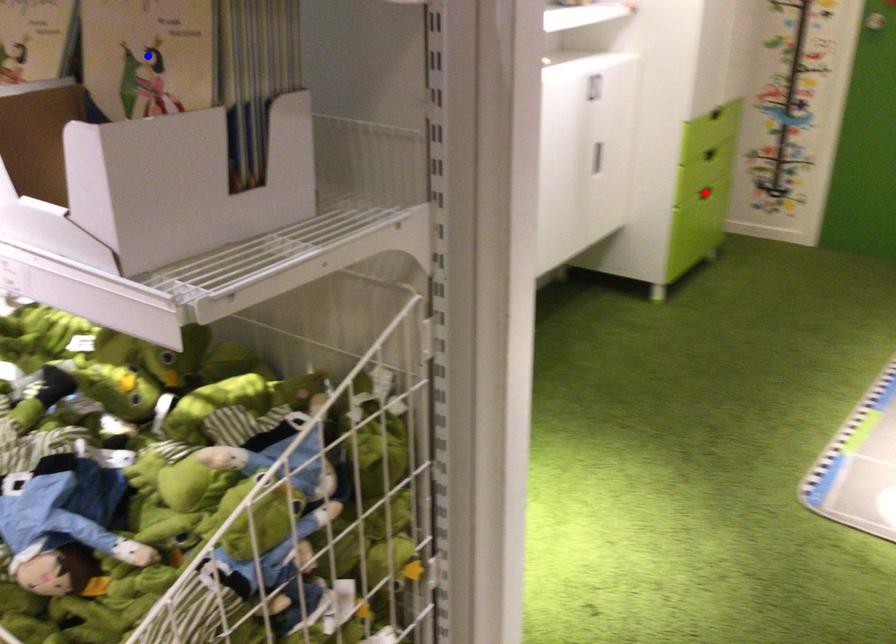
Question: Which of the two points in the image is closer to the camera?

Choices:
 (A) Blue point is closer.
 (B) Red point is closer.

Answer: (A)